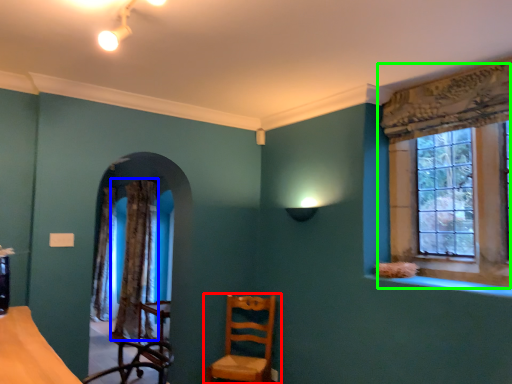
Question: Which object is positioned farthest from chair (highlighted by a red box)? Select from curtain (highlighted by a blue box) and window (highlighted by a green box).

Choices:
 (A) curtain
 (B) window

Answer: (B)